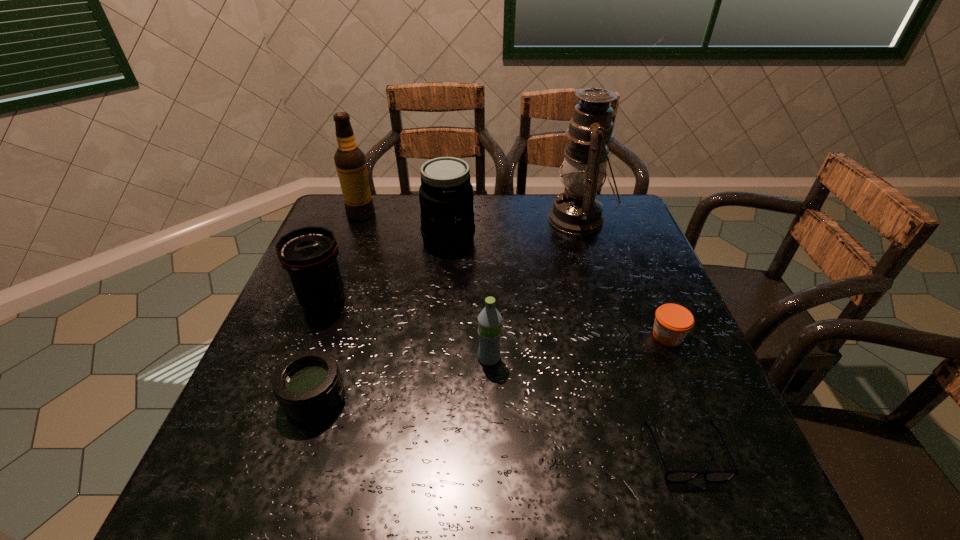
Where is `spectacles`? spectacles is located at coordinates (675, 476).

The height and width of the screenshot is (540, 960). Find the location of `free location located 0.290m on the left of the oil lamp`. free location located 0.290m on the left of the oil lamp is located at coordinates (453, 219).

At what (x,y) coordinates should I click in order to perform the action: click on vacant space located on the label of the second tallest object. Please return your answer as a coordinate pair (x, y). Looking at the image, I should click on (495, 214).

I want to click on vacant area situated on the front of the tallest telephoto lens, so click(445, 278).

The width and height of the screenshot is (960, 540). Identify the location of vacant space located on the right of the second nearest telephoto lens. (402, 300).

You are a GUI agent. You are given a task and a screenshot of the screen. Output one action in this format:
    pyautogui.click(x=<x>, y=<y>)
    Task: Click on the vacant space positioned 0.230m on the right of the fourth object from right to left
    
    Given the screenshot: What is the action you would take?
    pyautogui.click(x=608, y=358)

You are a GUI agent. You are given a task and a screenshot of the screen. Output one action in this format:
    pyautogui.click(x=<x>, y=<y>)
    Task: Click on the free spot located 0.280m on the side of the sixth tallest object with brand markings and control switches
    
    Given the screenshot: What is the action you would take?
    pyautogui.click(x=490, y=399)

Identify the location of free space located on the front label of the second shortest object. The height and width of the screenshot is (540, 960). (529, 336).

Where is `free space located on the front label of the second shortest object`? This screenshot has width=960, height=540. free space located on the front label of the second shortest object is located at coordinates (475, 336).

This screenshot has height=540, width=960. Find the location of `free region located 0.170m on the front label of the second shortest object`. free region located 0.170m on the front label of the second shortest object is located at coordinates (574, 336).